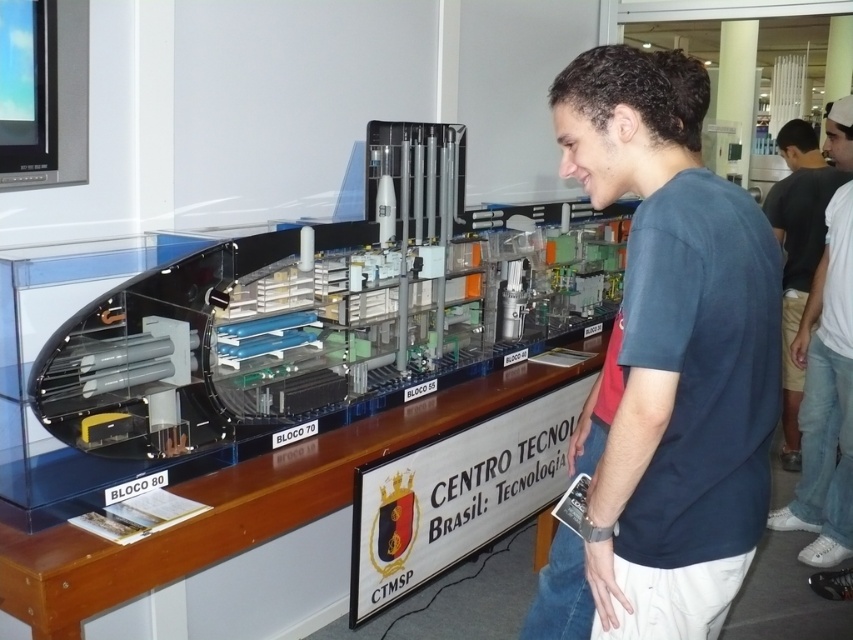
Who is positioned more to the right, blue cotton t-shirt at center or dark gray shirt at upper right?

dark gray shirt at upper right is more to the right.

Between point (651, 381) and point (788, 280), which one is positioned in front?

Positioned in front is point (651, 381).

The width and height of the screenshot is (853, 640). In order to click on blue cotton t-shirt at center in this screenshot , I will do `click(674, 348)`.